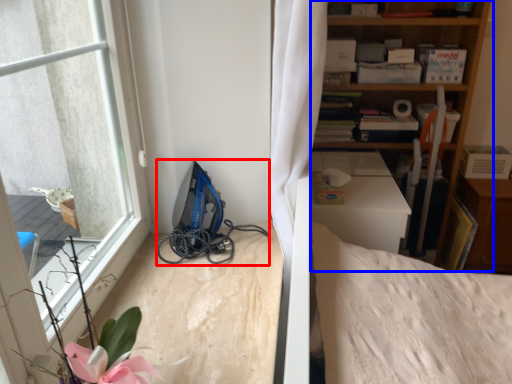
Question: Which of the following is the farthest to the observer, equipment (highlighted by a red box) or shelf (highlighted by a blue box)?

Choices:
 (A) equipment
 (B) shelf

Answer: (B)